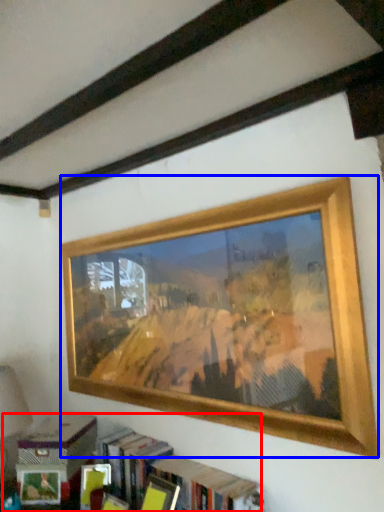
Question: Which object is further to the camera taking this photo, bookcase (highlighted by a red box) or picture frame (highlighted by a blue box)?

Choices:
 (A) bookcase
 (B) picture frame

Answer: (A)